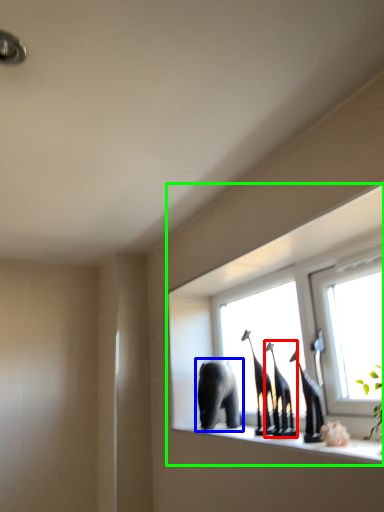
Question: Which object is the farthest from animal (highlighted by a red box)? Choose among these: elephant (highlighted by a blue box) or window (highlighted by a green box).

Choices:
 (A) elephant
 (B) window

Answer: (B)